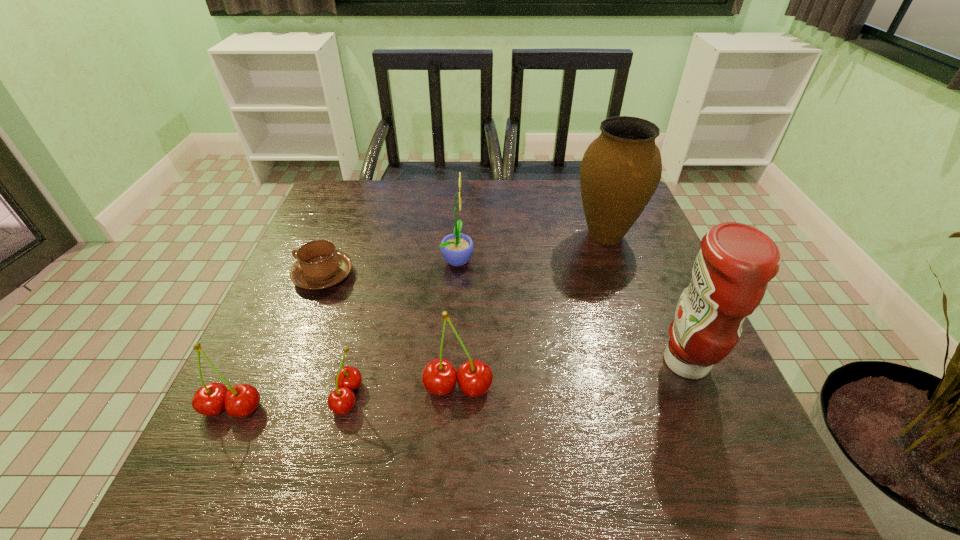
Where is `free point that satisfies the following two spatial constraints: 1. on the front-facing side of the condiment; 2. on the right side of the sunflower`? free point that satisfies the following two spatial constraints: 1. on the front-facing side of the condiment; 2. on the right side of the sunflower is located at coordinates (452, 362).

At what (x,y) coordinates should I click in order to perform the action: click on free space that satisfies the following two spatial constraints: 1. with the stems of the shortest cherry pointing upwards; 2. with the stems of the leftmost cherry pointing upwards. Please return your answer as a coordinate pair (x, y). Image resolution: width=960 pixels, height=540 pixels. Looking at the image, I should click on (345, 408).

Where is `vacant area that satisfies the following two spatial constraints: 1. on the side of the cappuccino with the handle; 2. with the stems of the second shortest cherry pointing upwards`? vacant area that satisfies the following two spatial constraints: 1. on the side of the cappuccino with the handle; 2. with the stems of the second shortest cherry pointing upwards is located at coordinates (271, 408).

The height and width of the screenshot is (540, 960). In order to click on free point that satisfies the following two spatial constraints: 1. on the back side of the condiment; 2. on the side of the shortest object with the handle in this screenshot , I will do `click(649, 275)`.